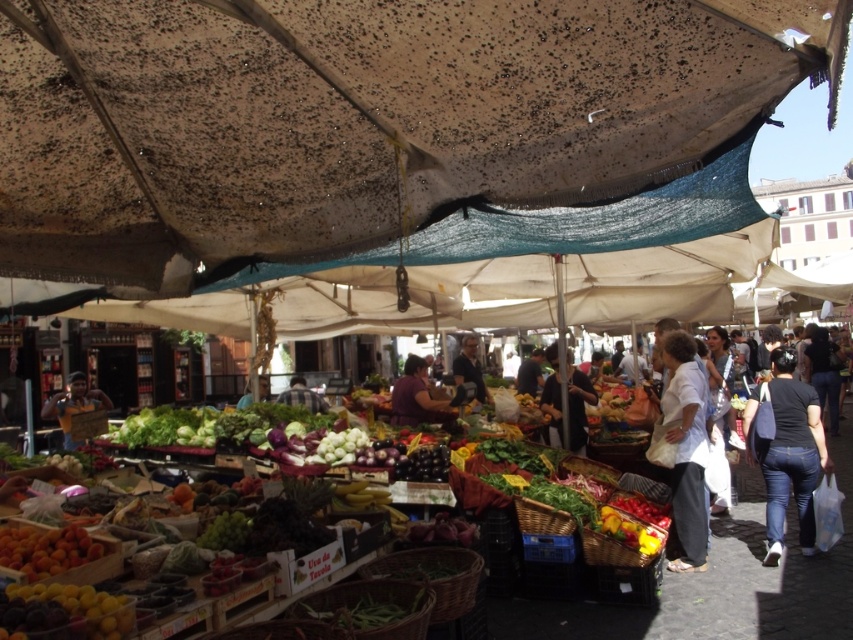
Question: Is white cotton shirt at center-right to the left of smooth purple fabric at center from the viewer's perspective?

Choices:
 (A) no
 (B) yes

Answer: (A)

Question: Does glossy purple grapes at center appear over dark blue shirt at center?

Choices:
 (A) no
 (B) yes

Answer: (A)

Question: Which point appears farthest from the camera in this image?

Choices:
 (A) (38, 554)
 (B) (231, 212)
 (C) (70, 628)

Answer: (B)

Question: Based on their relative distances, which object is farther from the dark gray sweater at center?

Choices:
 (A) yellow matte plums at lower left
 (B) matte yellow sign at center
 (C) dark fabric bag at center

Answer: (B)

Question: Can you confirm if brown fabric canopy at upper center is positioned to the left of checkered fabric shirt at center?

Choices:
 (A) no
 (B) yes

Answer: (A)

Question: Which point is farther to the camera?

Choices:
 (A) shiny orange peaches at lower left
 (B) matte yellow sign at center
 (C) brown fabric canopy at upper center

Answer: (B)